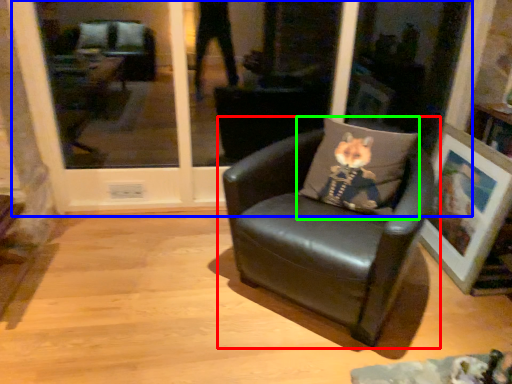
Question: Based on their relative distances, which object is nearer to chair (highlighted by a red box)? Choose from glass door (highlighted by a blue box) and pillow (highlighted by a green box).

Choices:
 (A) glass door
 (B) pillow

Answer: (B)